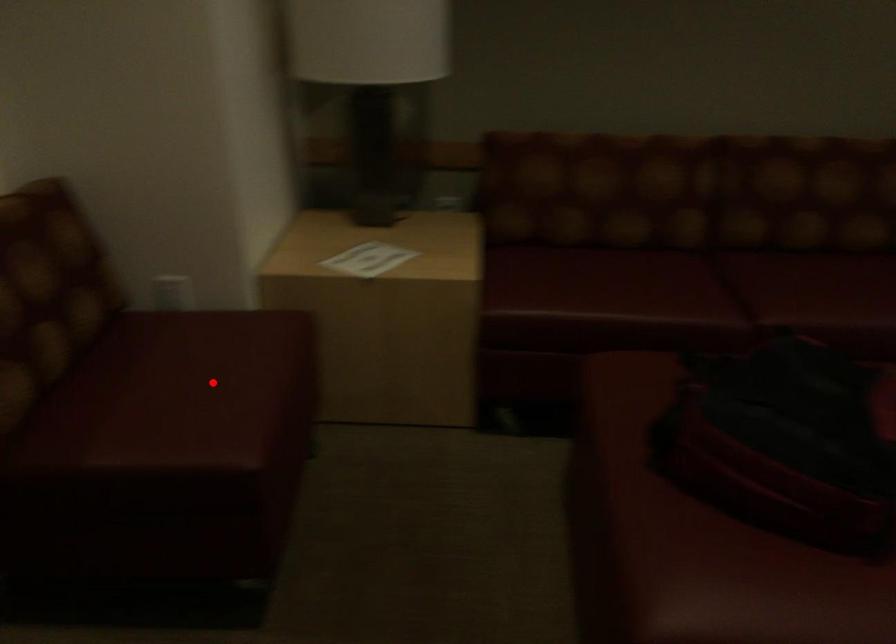
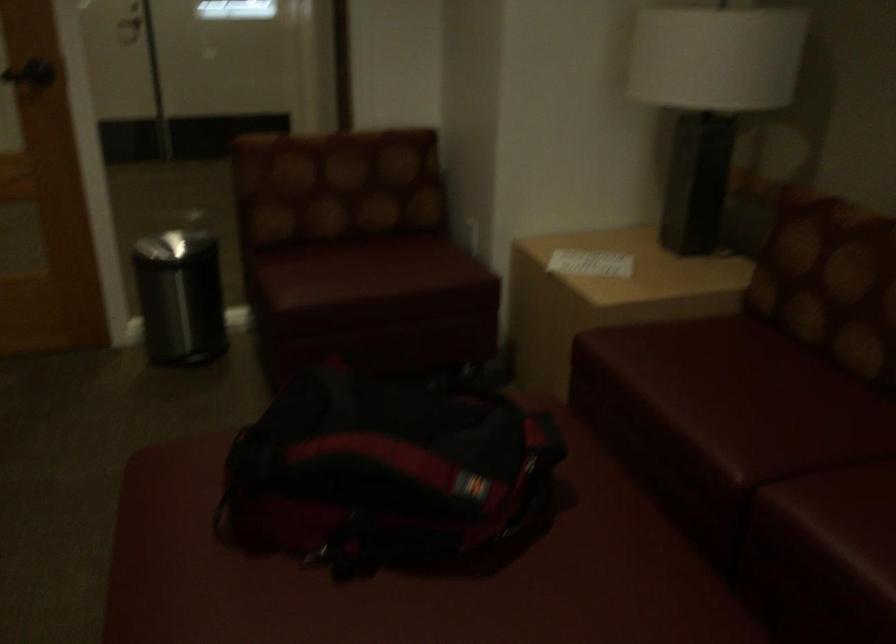
In the second image, find the point that corresponds to the highlighted location in the first image.

(367, 270)